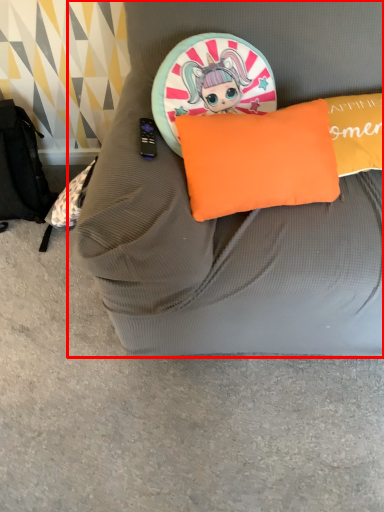
Question: Considering the relative positions of furniture (annotated by the red box) and pillow in the image provided, where is furniture (annotated by the red box) located with respect to the staircase?

Choices:
 (A) right
 (B) left

Answer: (A)